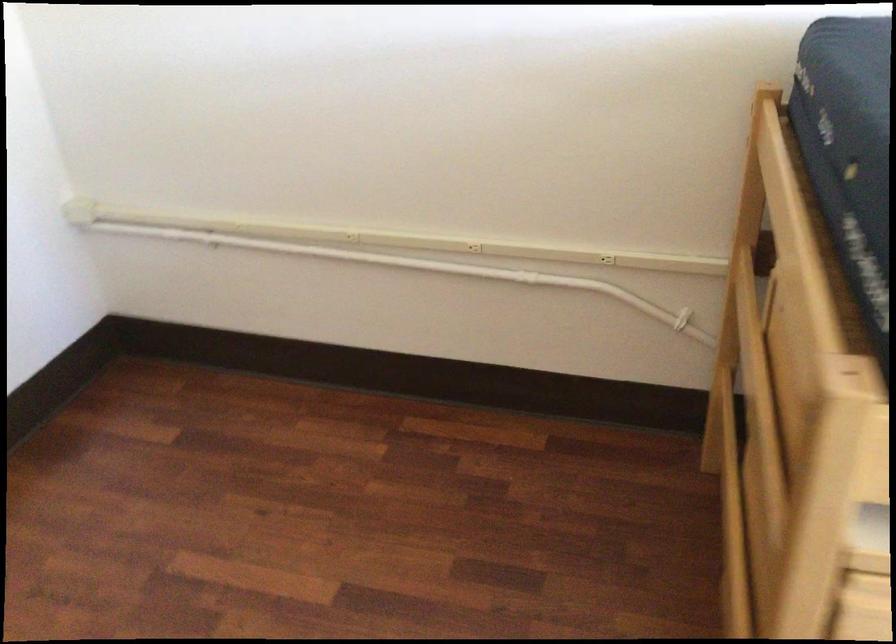
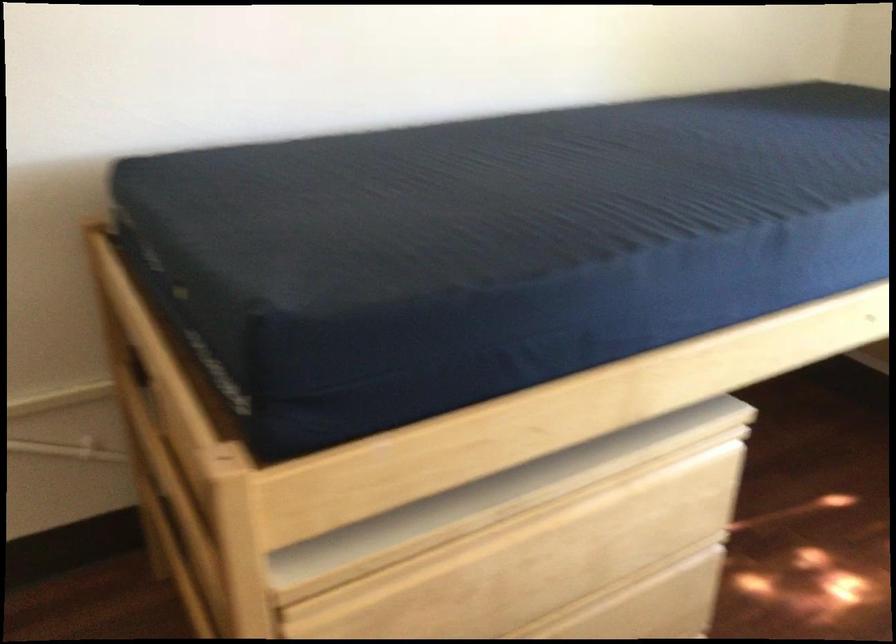
Question: Based on the continuous images, in which direction is the camera rotating? Reply with the corresponding letter.

Choices:
 (A) Left
 (B) Right
 (C) Up
 (D) Down

Answer: (B)